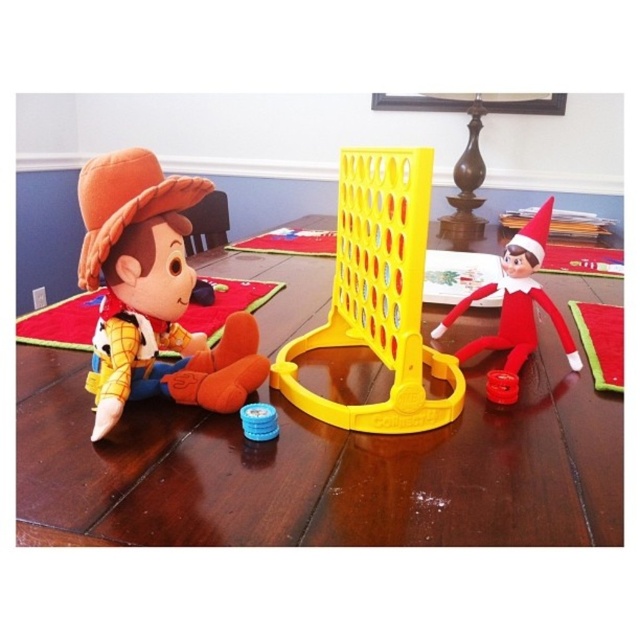
You are a parent trying to decide whether to place a new toy on the table. The table has the matte orange plush at left and the yellow plastic game at center. Which object is shorter in height?

The matte orange plush at left is shorter than the yellow plastic game at center.

You are a parent trying to store the yellow plastic game at center and the blue plastic game piece at center in a vertical storage rack. The rack has slots that can only accommodate items up to 15 cm in height. Can both items fit in the rack?

The yellow plastic game at center is much taller than the blue plastic game piece at center. Since the storage rack has a height limit of 15 cm, only the blue plastic game piece at center can fit. The yellow plastic game at center is too tall to fit into the rack.

You are organizing a playroom and need to place the matte orange plush at left and the yellow plastic game at center on a shelf. The shelf has limited space, and you want to ensure the smaller item is placed first. Which object should you place first?

The matte orange plush at left is smaller compared to the yellow plastic game at center, so you should place the matte orange plush at left first to ensure it fits properly on the shelf.